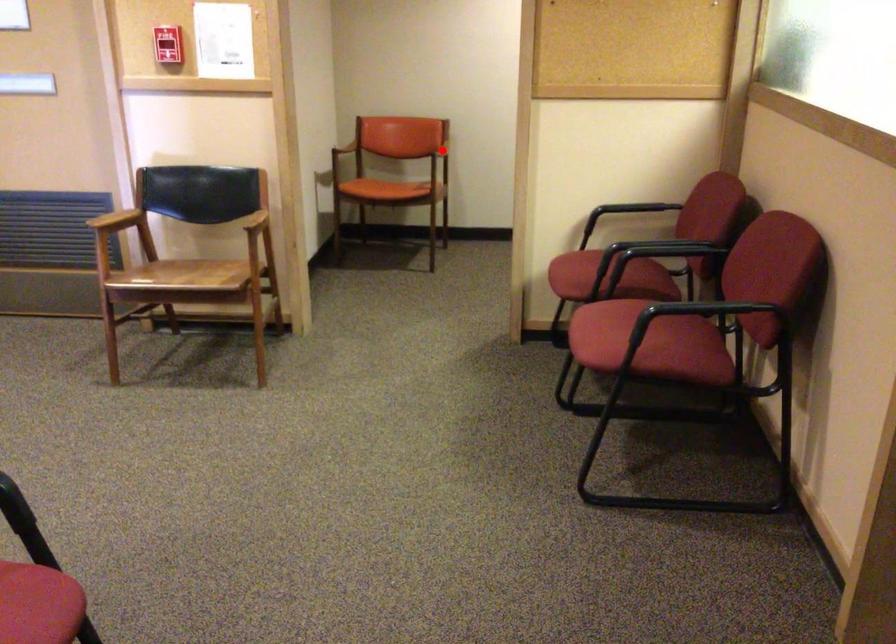
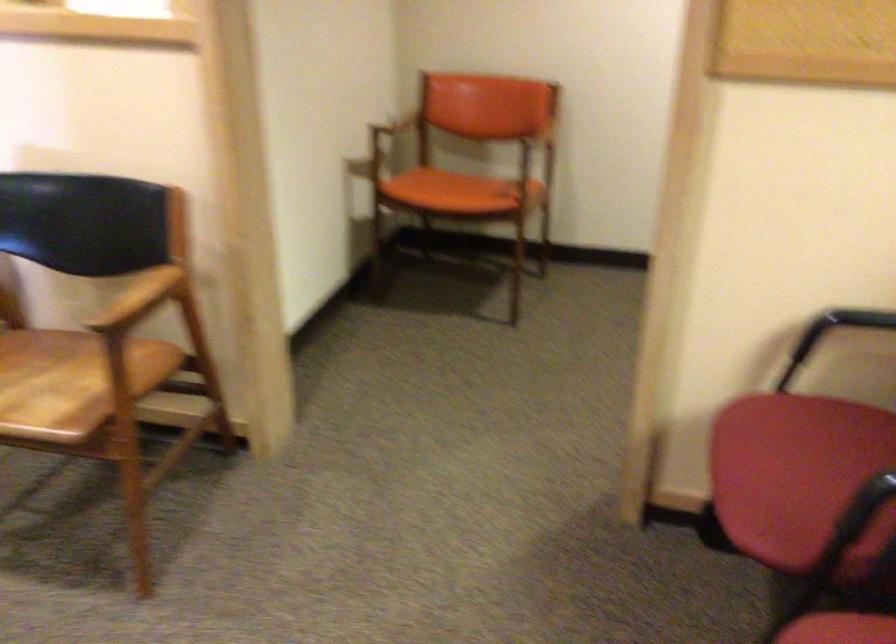
Question: I am providing you with two images of the same scene from different viewpoints. A red point is shown in image1. For the corresponding object point in image2, is it positioned nearer or farther from the camera?

Choices:
 (A) Nearer
 (B) Farther

Answer: (A)